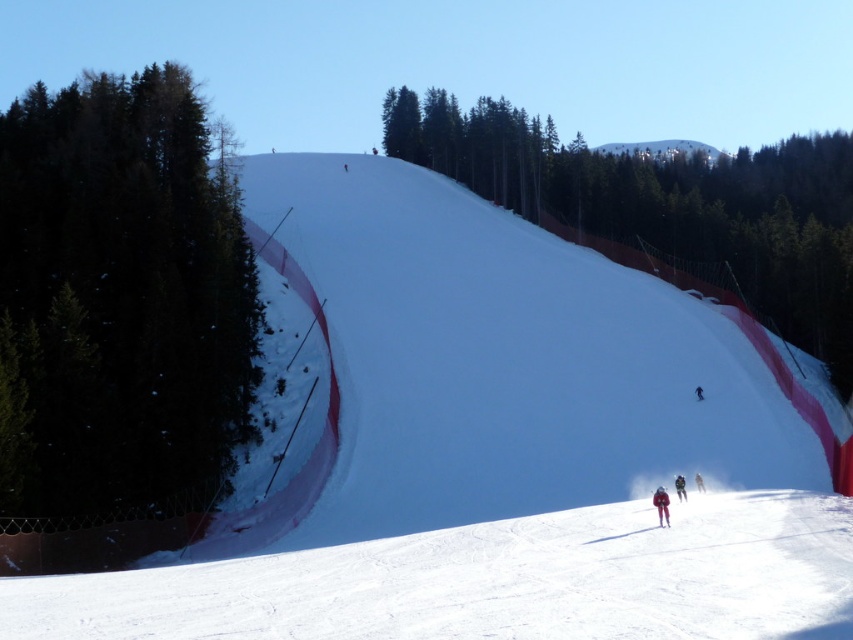
You are a photographer planning to capture a wide shot of the black matte skier at center and the white matte ski at center. Based on their sizes in the image, which one would appear smaller in the photo?

The black matte skier at center appears smaller in the photo because it occupies less space than the white matte ski at center.

You are a ski instructor observing the slope. You notice a white snowboarder at center and a white matte ski at center. Which object is closer to you?

The white snowboarder at center is closer to you because the white matte ski at center is behind it.

You are a skier on the snowy slope and want to reach the finish line marked by point [675,476]. There is an obstacle at point [189,180]. Will you encounter the obstacle before reaching the finish line?

Point [189,180] is behind point [675,476], so you will reach the finish line before encountering the obstacle.